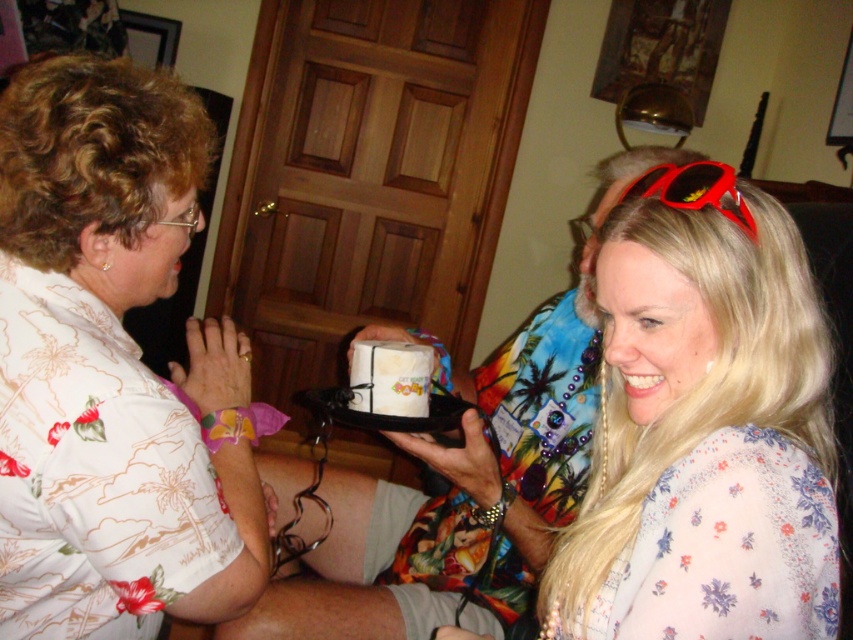
You are trying to decide whether to place a large decorative item on the table between the white floral shirt at upper left and the red plastic sunglasses at upper right. Based on their sizes, which object should you consider placing the item closer to?

The white floral shirt at upper left is larger in size than the red plastic sunglasses at upper right, so you should place the item closer to the white floral shirt at upper left to ensure stability.

You are standing in the room and want to reach both points, point (244, 538) and point (730, 188). Which point is closer to you?

Point (244, 538) is closer to you because it is further to the camera than point (730, 188).

You are a photographer at the event and need to ensure both the white floral shirt at upper left and the white paper cake at center are visible in the photo. Given their sizes, which object should you focus on to ensure both are in frame without cropping?

Since the white floral shirt at upper left is much taller than the white paper cake at center, you should focus on the white floral shirt at upper left to ensure both objects are fully visible in the photo.